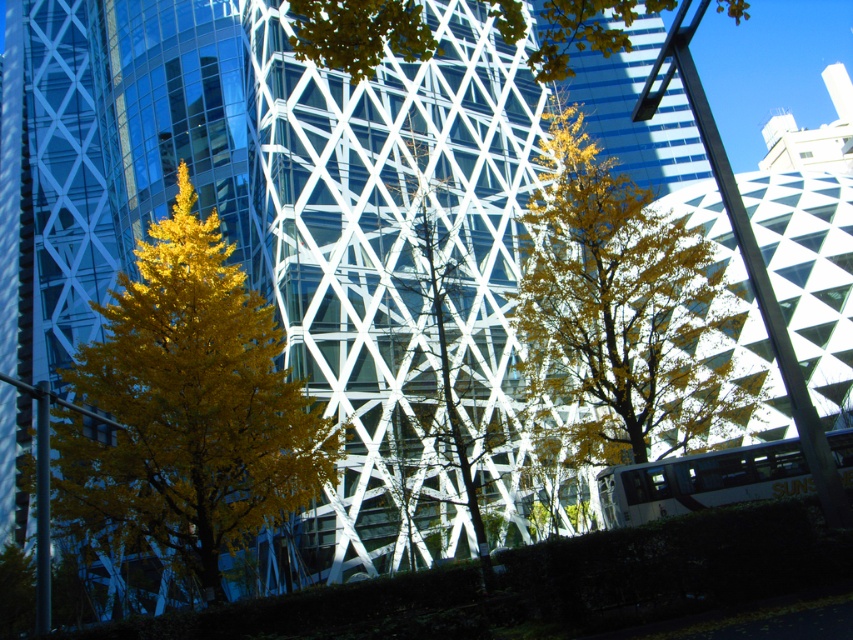
Question: Does yellow leafy tree at left have a lesser width compared to yellow leafy tree at upper center?

Choices:
 (A) no
 (B) yes

Answer: (B)

Question: Among these points, which one is farthest from the camera?

Choices:
 (A) (601, 240)
 (B) (558, 49)

Answer: (B)

Question: Which object is farther from the camera taking this photo?

Choices:
 (A) yellow leafy tree at upper center
 (B) yellow leafy tree at left

Answer: (B)

Question: Which of these objects is positioned closest to the green leafy tree at center?

Choices:
 (A) yellow leafy tree at upper center
 (B) yellow leafy tree at left

Answer: (B)

Question: Observing the image, what is the correct spatial positioning of yellow leafy tree at upper center in reference to green leafy tree at center?

Choices:
 (A) right
 (B) left

Answer: (A)

Question: Does yellow leafy tree at center appear over green leafy tree at center?

Choices:
 (A) yes
 (B) no

Answer: (A)